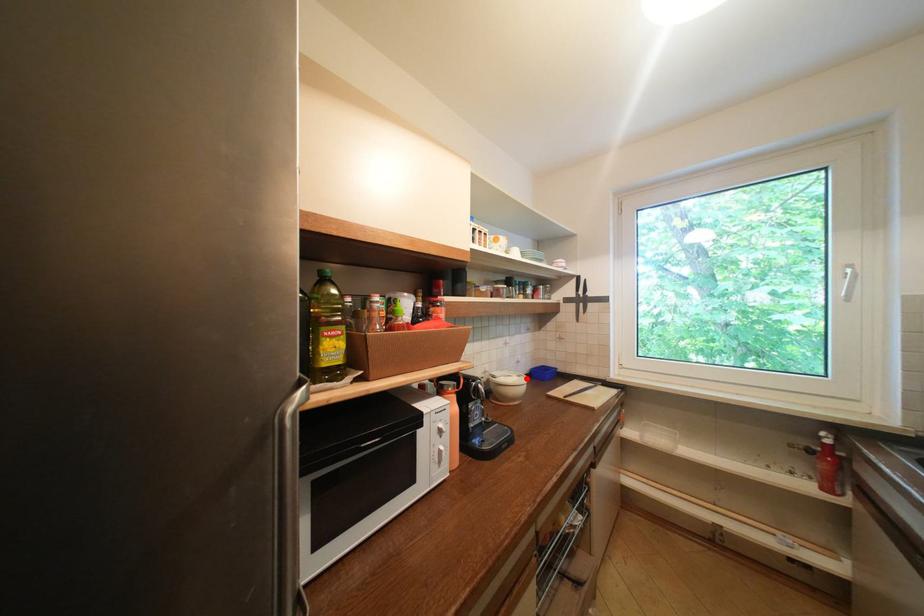
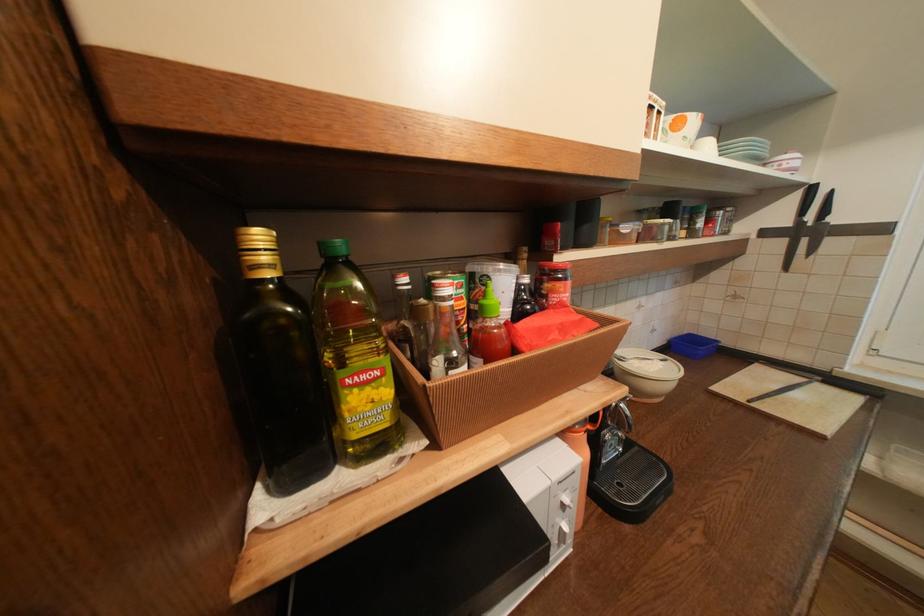
The point at the highlighted location is marked in the first image. Where is the corresponding point in the second image?

(670, 363)